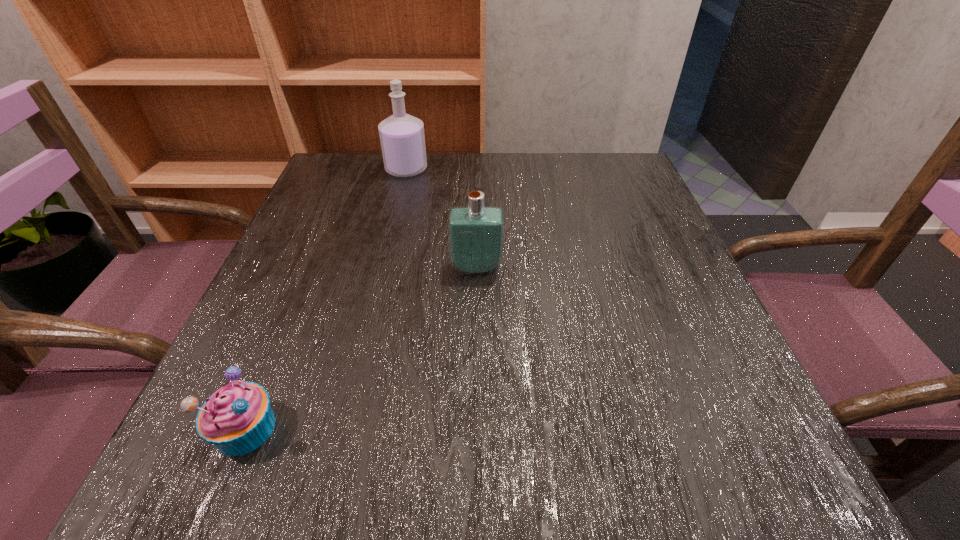
This screenshot has width=960, height=540. I want to click on vacant space in between the shortest object and the shorter perfume, so click(x=361, y=348).

Identify the location of vacant area between the farther perfume and the leftmost object. This screenshot has width=960, height=540. (326, 299).

Locate an element on the screen. vacant area that lies between the farthest object and the muffin is located at coordinates (326, 299).

The image size is (960, 540). Identify the location of object that is the closest to the second tallest object. (402, 138).

At what (x,y) coordinates should I click in order to perform the action: click on object that is the closest to the nearer perfume. Please return your answer as a coordinate pair (x, y). Looking at the image, I should click on (402, 138).

The image size is (960, 540). Find the location of `free space that satisfies the following two spatial constraints: 1. on the back side of the taller perfume; 2. on the left side of the muffin`. free space that satisfies the following two spatial constraints: 1. on the back side of the taller perfume; 2. on the left side of the muffin is located at coordinates (353, 170).